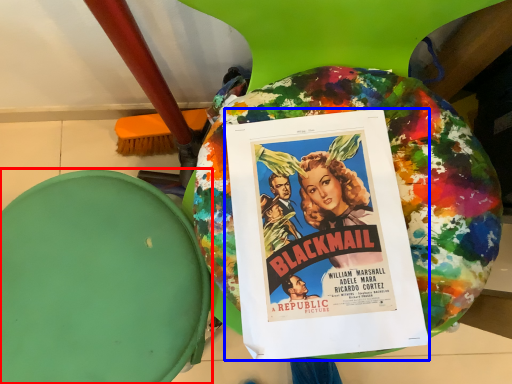
Question: Among these objects, which one is nearest to the camera, bean bag chair (highlighted by a red box) or poster (highlighted by a blue box)?

Choices:
 (A) bean bag chair
 (B) poster

Answer: (B)